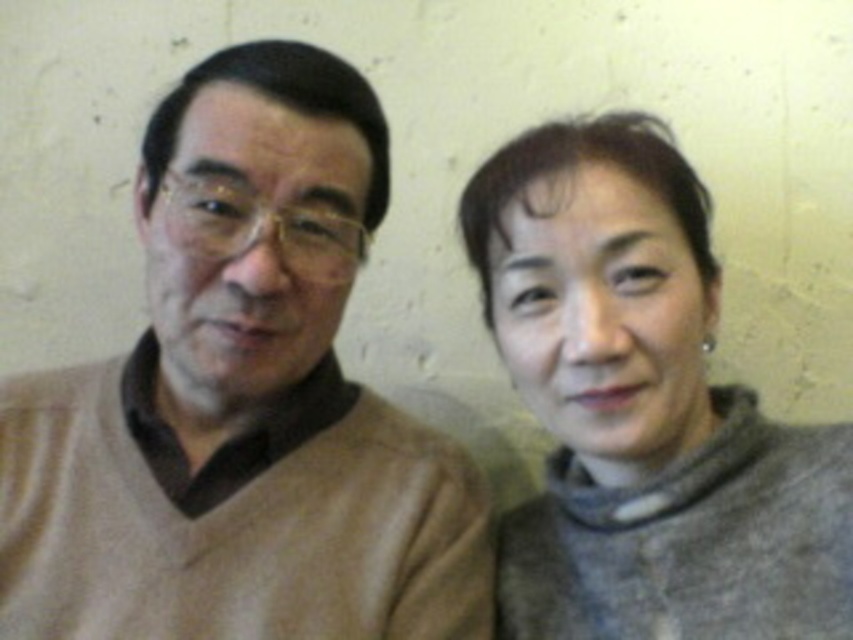
You are a photographer trying to capture a closeup shot of both the beige sweater at left and the gray woolen sweater at right in the image. Given that your camera can only focus on objects within a 6 inch range, will you be able to capture both sweaters in focus?

The beige sweater at left and gray woolen sweater at right are 7.54 inches apart, which exceeds the camera focus range of 6 inches. Therefore, both sweaters cannot be captured in focus simultaneously.

In the scene shown: You are a photographer setting up for a portrait. You see two subjects wearing the beige sweater at left and the gray woolen sweater at right. Which sweater is closer to the left side of the frame?

The beige sweater at left is positioned on the left side of the gray woolen sweater at right, so the beige sweater at left is closer to the left side of the frame.